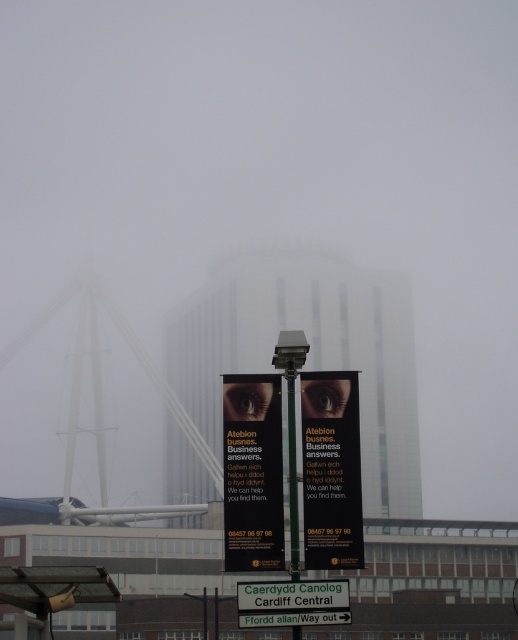
Question: Can you confirm if black matte sign at center is bigger than white plastic street sign at center?

Choices:
 (A) yes
 (B) no

Answer: (A)

Question: Is black matte banner at center thinner than white plastic street sign at center?

Choices:
 (A) yes
 (B) no

Answer: (A)

Question: Which of the following is the closest to the observer?

Choices:
 (A) (297, 621)
 (B) (355, 518)

Answer: (A)

Question: Which point is farther to the camera?

Choices:
 (A) (255, 545)
 (B) (272, 593)

Answer: (A)

Question: Observing the image, what is the correct spatial positioning of black matte sign at center in reference to white plastic street sign at center?

Choices:
 (A) above
 (B) below

Answer: (A)

Question: Which point is farther to the camera?

Choices:
 (A) white plastic street sign at center
 (B) black matte sign at center
 (C) black matte banner at center

Answer: (C)